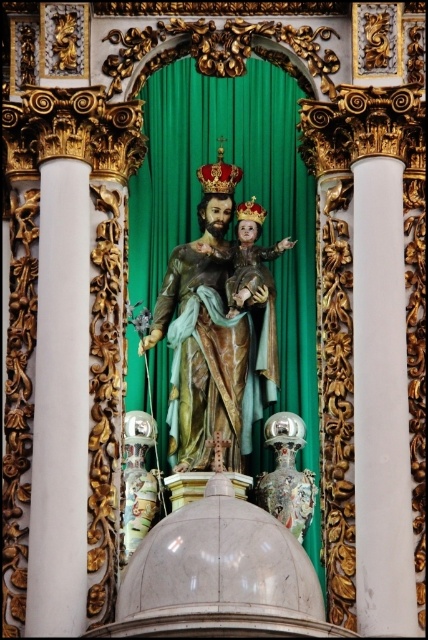
Who is positioned more to the left, green velvet curtain at center or polychrome wood statue at center?

From the viewer's perspective, polychrome wood statue at center appears more on the left side.

Can you confirm if green velvet curtain at center is positioned to the left of polychrome wood statue at center?

Incorrect, green velvet curtain at center is not on the left side of polychrome wood statue at center.

The height and width of the screenshot is (640, 428). I want to click on green velvet curtain at center, so click(235, 198).

Between polychrome wood statue at center and white smooth column at right, which one has more height?

Standing taller between the two is white smooth column at right.

Where is `polychrome wood statue at center`? The height and width of the screenshot is (640, 428). polychrome wood statue at center is located at coordinates (217, 328).

Locate an element on the screen. polychrome wood statue at center is located at coordinates (217, 328).

Locate an element on the screen. polychrome wood statue at center is located at coordinates (217, 328).

Does green velvet curtain at center have a lesser width compared to white smooth column at right?

Incorrect, green velvet curtain at center's width is not less than white smooth column at right's.

Between green velvet curtain at center and white smooth column at right, which one is positioned lower?

white smooth column at right

Which is behind, point (231, 157) or point (392, 556)?

Positioned behind is point (231, 157).

The image size is (428, 640). What are the coordinates of `green velvet curtain at center` in the screenshot? It's located at (235, 198).